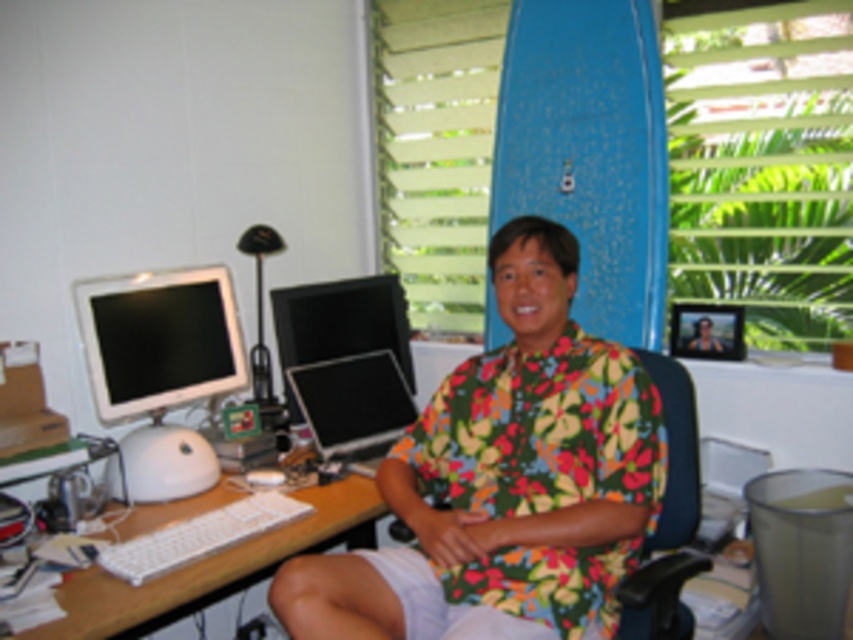
Can you confirm if white glossy computer monitor at left is positioned to the left of blue fabric swivel chair at center?

Indeed, white glossy computer monitor at left is positioned on the left side of blue fabric swivel chair at center.

Does white glossy computer monitor at left have a larger size compared to blue fabric swivel chair at center?

No, white glossy computer monitor at left is not bigger than blue fabric swivel chair at center.

Does point (180, 400) lie in front of point (686, 376)?

No, (180, 400) is further to viewer.

Find the location of a particular element. The height and width of the screenshot is (640, 853). white glossy computer monitor at left is located at coordinates (160, 339).

Is floral fabric shirt at center to the right of white plastic keyboard at lower left from the viewer's perspective?

Yes, floral fabric shirt at center is to the right of white plastic keyboard at lower left.

Does point (567, 253) come farther from viewer compared to point (228, 579)?

Yes, it is behind point (228, 579).

Find the location of a particular element. Image resolution: width=853 pixels, height=640 pixels. floral fabric shirt at center is located at coordinates (506, 481).

The width and height of the screenshot is (853, 640). I want to click on floral fabric shirt at center, so click(506, 481).

Consider the image. How distant is blue fabric swivel chair at center from black glossy monitor at center?

blue fabric swivel chair at center and black glossy monitor at center are 89.21 centimeters apart.

Who is positioned more to the right, blue fabric swivel chair at center or black glossy monitor at center?

blue fabric swivel chair at center is more to the right.

Does point (682, 637) lie behind point (302, 362)?

No, (682, 637) is in front of (302, 362).

You are a GUI agent. You are given a task and a screenshot of the screen. Output one action in this format:
    pyautogui.click(x=<x>, y=<y>)
    Task: Click on the blue fabric swivel chair at center
    Image resolution: width=853 pixels, height=640 pixels.
    Given the screenshot: What is the action you would take?
    pyautogui.click(x=676, y=452)